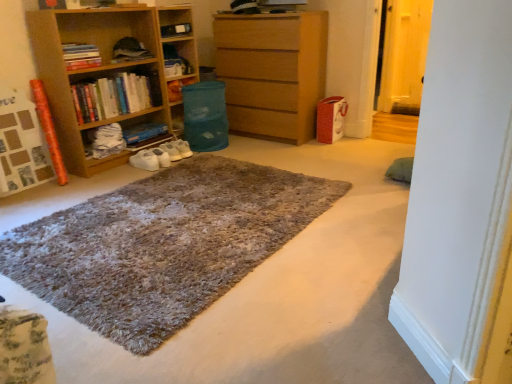
Find the location of `hardcover books at left, the second book viewed from the top`. hardcover books at left, the second book viewed from the top is located at coordinates 111,97.

In order to face wooden chest of drawers at center, should I rotate leftwards or rightwards?

You should look right and rotate roughly 2.047 degrees.

Image resolution: width=512 pixels, height=384 pixels. Identify the location of matte plastic water at center, which is counted as the 2th shelf, starting from the left. (178, 88).

What do you see at coordinates (163, 245) in the screenshot?
I see `shaggy carpet at center` at bounding box center [163, 245].

Describe the element at coordinates (81, 56) in the screenshot. The image size is (512, 384). I see `hardcover books at left, which is counted as the 3th book, starting from the bottom` at that location.

I want to click on transparent glass door at right, so click(x=404, y=52).

Is hardcover books at left, the second book viewed from the top, wider or thinner than blue cardboard book at center, arranged as the 1th book when ordered from the bottom?

Clearly, hardcover books at left, the second book viewed from the top, has less width compared to blue cardboard book at center, arranged as the 1th book when ordered from the bottom.

Is blue cardboard book at center, arranged as the 1th book when ordered from the bottom, completely or partially inside hardcover books at left, which is the second book in bottom-to-top order?

No, blue cardboard book at center, arranged as the 1th book when ordered from the bottom, is located outside of hardcover books at left, which is the second book in bottom-to-top order.

Does hardcover books at left, which is the second book in bottom-to-top order, have a larger size compared to blue cardboard book at center, placed as the 3th book when sorted from top to bottom?

Correct, hardcover books at left, which is the second book in bottom-to-top order, is larger in size than blue cardboard book at center, placed as the 3th book when sorted from top to bottom.

Is hardcover books at left, which is the second book in bottom-to-top order, positioned with its back to blue cardboard book at center, placed as the 3th book when sorted from top to bottom?

hardcover books at left, which is the second book in bottom-to-top order, does not have its back to blue cardboard book at center, placed as the 3th book when sorted from top to bottom.

Between point (385, 82) and point (81, 46), which one is positioned behind?

Positioned behind is point (385, 82).

Based on their positions, is transparent glass door at right located to the left or right of hardcover books at left, which is counted as the 3th book, starting from the bottom?

Clearly, transparent glass door at right is on the right of hardcover books at left, which is counted as the 3th book, starting from the bottom, in the image.

Looking at this image, can you confirm if wooden chest of drawers at center is shorter than matte plastic water at center, which is counted as the 2th shelf, starting from the left?

Incorrect, the height of wooden chest of drawers at center does not fall short of that of matte plastic water at center, which is counted as the 2th shelf, starting from the left.

Identify the location of shelf that is the 1st one when counting downward from the wooden chest of drawers at center (from the image's perspective). (178, 88).

Considering their positions, is wooden chest of drawers at center located in front of or behind matte plastic water at center, which is counted as the 2th shelf, starting from the left?

Clearly, wooden chest of drawers at center is in front of matte plastic water at center, which is counted as the 2th shelf, starting from the left.

From the image's perspective, between hardcover books at left, marked as the first book in a top-to-bottom arrangement, and matte plastic water at center, which is the first shelf in right-to-left order, who is located below?

matte plastic water at center, which is the first shelf in right-to-left order, from the image's perspective.

Is matte plastic water at center, which is counted as the 2th shelf, starting from the left, a part of hardcover books at left, marked as the first book in a top-to-bottom arrangement?

Actually, matte plastic water at center, which is counted as the 2th shelf, starting from the left, is outside hardcover books at left, marked as the first book in a top-to-bottom arrangement.

This screenshot has height=384, width=512. Find the location of `the 3rd book counting from the left of the matte plastic water at center, which is counted as the 2th shelf, starting from the left`. the 3rd book counting from the left of the matte plastic water at center, which is counted as the 2th shelf, starting from the left is located at coordinates (81, 56).

From the picture: Is wooden bookshelf at left, the first shelf when ordered from left to right, placed right next to transparent glass door at right?

wooden bookshelf at left, the first shelf when ordered from left to right, is not next to transparent glass door at right, and they're not touching.

Is the depth of wooden bookshelf at left, marked as the second shelf in a right-to-left arrangement, greater than that of transparent glass door at right?

No, wooden bookshelf at left, marked as the second shelf in a right-to-left arrangement, is closer to the viewer.

Considering the sizes of objects wooden bookshelf at left, the first shelf when ordered from left to right, and transparent glass door at right in the image provided, who is bigger, wooden bookshelf at left, the first shelf when ordered from left to right, or transparent glass door at right?

wooden bookshelf at left, the first shelf when ordered from left to right.

Identify the location of the 2nd shelf counting from the left of the transparent glass door at right. (106, 73).

From the picture: Which of these two, hardcover books at left, marked as the first book in a top-to-bottom arrangement, or shaggy carpet at center, is wider?

shaggy carpet at center is wider.

Which of these two, hardcover books at left, which is counted as the 3th book, starting from the bottom, or shaggy carpet at center, is bigger?

shaggy carpet at center.

Does hardcover books at left, marked as the first book in a top-to-bottom arrangement, touch shaggy carpet at center?

No, hardcover books at left, marked as the first book in a top-to-bottom arrangement, is not in contact with shaggy carpet at center.

Which of these two, blue cardboard book at center, placed as the 3th book when sorted from top to bottom, or matte plastic water at center, which is the first shelf in right-to-left order, is smaller?

Smaller between the two is matte plastic water at center, which is the first shelf in right-to-left order.

Is blue cardboard book at center, arranged as the 1th book when ordered from the bottom, touching matte plastic water at center, which is the first shelf in right-to-left order?

They are not placed beside each other.

Can you confirm if blue cardboard book at center, arranged as the 1th book when ordered from the bottom, is wider than matte plastic water at center, which is the first shelf in right-to-left order?

Yes, blue cardboard book at center, arranged as the 1th book when ordered from the bottom, is wider than matte plastic water at center, which is the first shelf in right-to-left order.

Would you say blue cardboard book at center, arranged as the 1th book when ordered from the bottom, is inside or outside matte plastic water at center, which is the first shelf in right-to-left order?

blue cardboard book at center, arranged as the 1th book when ordered from the bottom, is located beyond the bounds of matte plastic water at center, which is the first shelf in right-to-left order.

Identify the location of book that is the 1st object located above the blue cardboard book at center, arranged as the 1th book when ordered from the bottom (from the image's perspective). The height and width of the screenshot is (384, 512). (111, 97).

In order to click on the 1st book below the transparent glass door at right (from the image's perspective) in this screenshot , I will do `click(81, 56)`.

Based on their spatial positions, is blue cardboard book at center, placed as the 3th book when sorted from top to bottom, or hardcover books at left, marked as the first book in a top-to-bottom arrangement, further from wooden bookshelf at left, the first shelf when ordered from left to right?

Among the two, blue cardboard book at center, placed as the 3th book when sorted from top to bottom, is located further to wooden bookshelf at left, the first shelf when ordered from left to right.

Estimate the real-world distances between objects in this image. Which object is further from transparent glass door at right, wooden chest of drawers at center or hardcover books at left, marked as the first book in a top-to-bottom arrangement?

hardcover books at left, marked as the first book in a top-to-bottom arrangement.

Based on their spatial positions, is wooden bookshelf at left, the first shelf when ordered from left to right, or hardcover books at left, which is counted as the 3th book, starting from the bottom, further from shaggy carpet at center?

hardcover books at left, which is counted as the 3th book, starting from the bottom, is positioned further to the anchor shaggy carpet at center.

Looking at the image, which one is located closer to hardcover books at left, which is counted as the 3th book, starting from the bottom, wooden chest of drawers at center or blue cardboard book at center, placed as the 3th book when sorted from top to bottom?

blue cardboard book at center, placed as the 3th book when sorted from top to bottom, is closer to hardcover books at left, which is counted as the 3th book, starting from the bottom.

Based on their spatial positions, is blue cardboard book at center, arranged as the 1th book when ordered from the bottom, or hardcover books at left, the second book viewed from the top, closer to shaggy carpet at center?

hardcover books at left, the second book viewed from the top, lies closer to shaggy carpet at center than the other object.

Looking at the image, which one is located closer to wooden bookshelf at left, marked as the second shelf in a right-to-left arrangement, hardcover books at left, the second book viewed from the top, or matte plastic water at center, which is the first shelf in right-to-left order?

hardcover books at left, the second book viewed from the top, is positioned closer to the anchor wooden bookshelf at left, marked as the second shelf in a right-to-left arrangement.

Based on their spatial positions, is blue cardboard book at center, placed as the 3th book when sorted from top to bottom, or hardcover books at left, which is the second book in bottom-to-top order, further from hardcover books at left, marked as the first book in a top-to-bottom arrangement?

Based on the image, blue cardboard book at center, placed as the 3th book when sorted from top to bottom, appears to be further to hardcover books at left, marked as the first book in a top-to-bottom arrangement.

When comparing their distances from shaggy carpet at center, does blue cardboard book at center, placed as the 3th book when sorted from top to bottom, or wooden chest of drawers at center seem closer?

Based on the image, blue cardboard book at center, placed as the 3th book when sorted from top to bottom, appears to be nearer to shaggy carpet at center.

This screenshot has height=384, width=512. I want to click on the chest of drawers situated between hardcover books at left, which is the second book in bottom-to-top order, and transparent glass door at right from left to right, so click(x=272, y=72).

Where is `the chest of drawers located between shaggy carpet at center and matte plastic water at center, which is counted as the 2th shelf, starting from the left, in the depth direction`? The height and width of the screenshot is (384, 512). the chest of drawers located between shaggy carpet at center and matte plastic water at center, which is counted as the 2th shelf, starting from the left, in the depth direction is located at coordinates point(272,72).

Where is `doormat between hardcover books at left, which is the second book in bottom-to-top order, and transparent glass door at right`? doormat between hardcover books at left, which is the second book in bottom-to-top order, and transparent glass door at right is located at coordinates (163, 245).

The width and height of the screenshot is (512, 384). Identify the location of shelf located between shaggy carpet at center and hardcover books at left, the second book viewed from the top, in the depth direction. (106, 73).